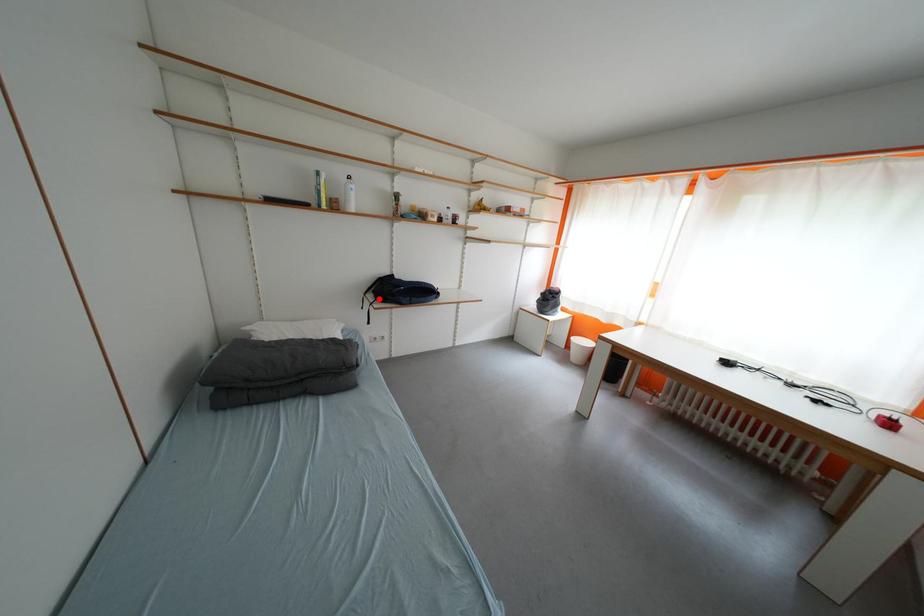
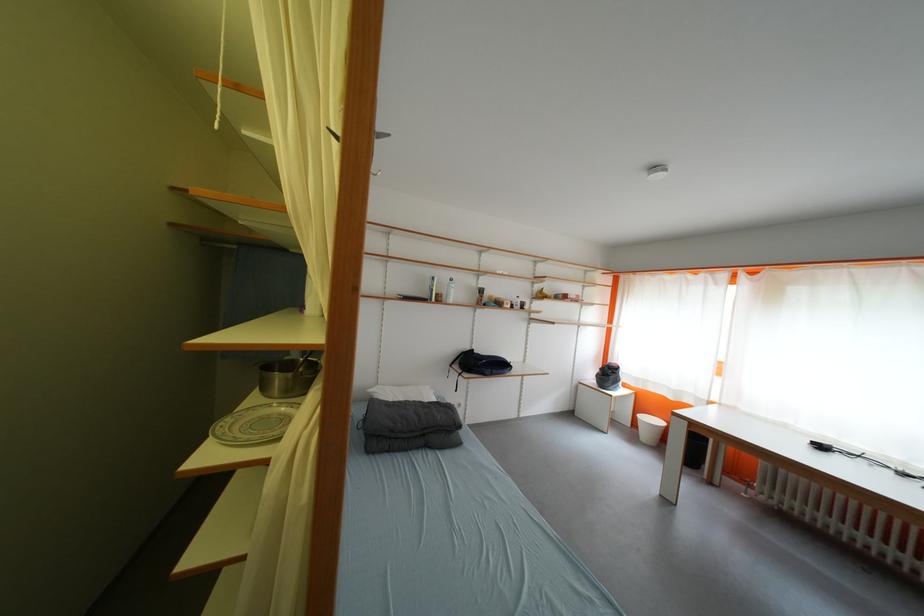
Question: A red point is marked in image1. In image2, is the corresponding 3D point closer to the camera or farther? Reply with the corresponding letter.

Choices:
 (A) The corresponding 3D point is closer.
 (B) The corresponding 3D point is farther.

Answer: (B)